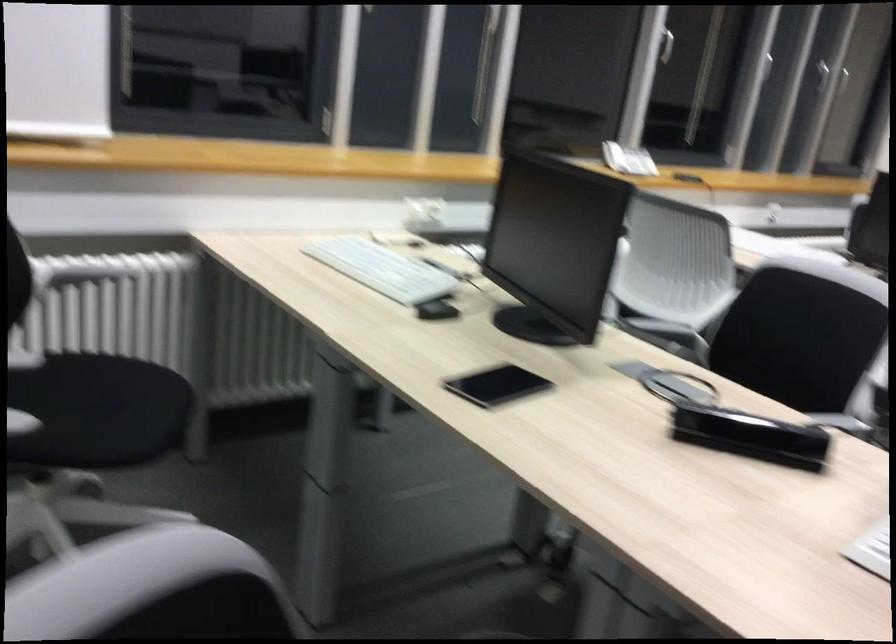
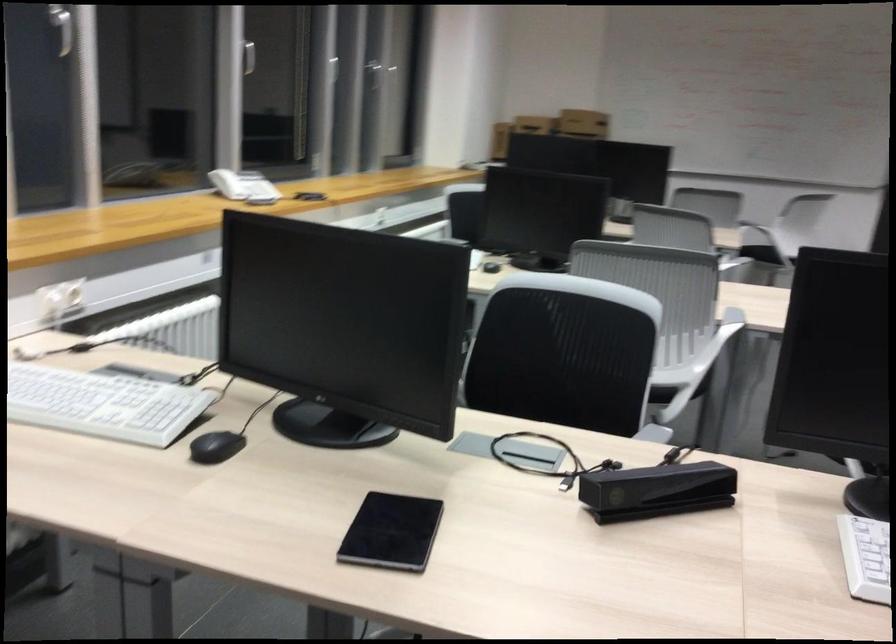
Where in the second image is the point corresponding to (x=614, y=147) from the first image?

(227, 184)